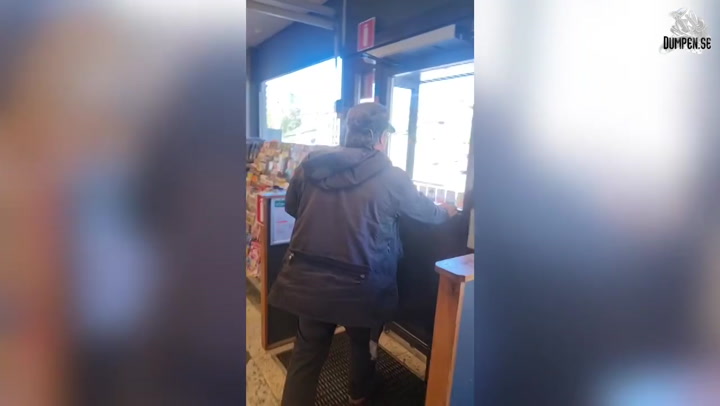
The height and width of the screenshot is (406, 720). What are the coordinates of `windows` in the screenshot? It's located at (449, 128), (299, 100).